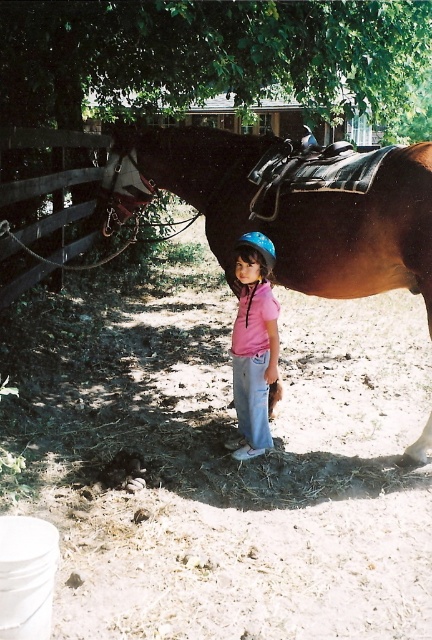
Between brown leather saddle at upper center and pink matte helmet at center, which one is positioned lower?

pink matte helmet at center is lower down.

Is brown leather saddle at upper center to the left of pink matte helmet at center from the viewer's perspective?

Incorrect, brown leather saddle at upper center is not on the left side of pink matte helmet at center.

Measure the distance between brown leather saddle at upper center and camera.

A distance of 12.09 feet exists between brown leather saddle at upper center and camera.

Where is `brown leather saddle at upper center`? The image size is (432, 640). brown leather saddle at upper center is located at coordinates (286, 209).

Can you confirm if brown wooden fence at left is positioned below pink matte helmet at center?

Actually, brown wooden fence at left is above pink matte helmet at center.

Looking at this image, who is higher up, brown wooden fence at left or pink matte helmet at center?

brown wooden fence at left

The image size is (432, 640). I want to click on brown wooden fence at left, so click(50, 225).

Locate an element on the screen. The height and width of the screenshot is (640, 432). brown wooden fence at left is located at coordinates [x=50, y=225].

Does green leafy tree at upper center appear under brown wooden fence at left?

No, green leafy tree at upper center is not below brown wooden fence at left.

Is green leafy tree at upper center wider than brown wooden fence at left?

In fact, green leafy tree at upper center might be narrower than brown wooden fence at left.

Locate an element on the screen. Image resolution: width=432 pixels, height=640 pixels. green leafy tree at upper center is located at coordinates (225, 49).